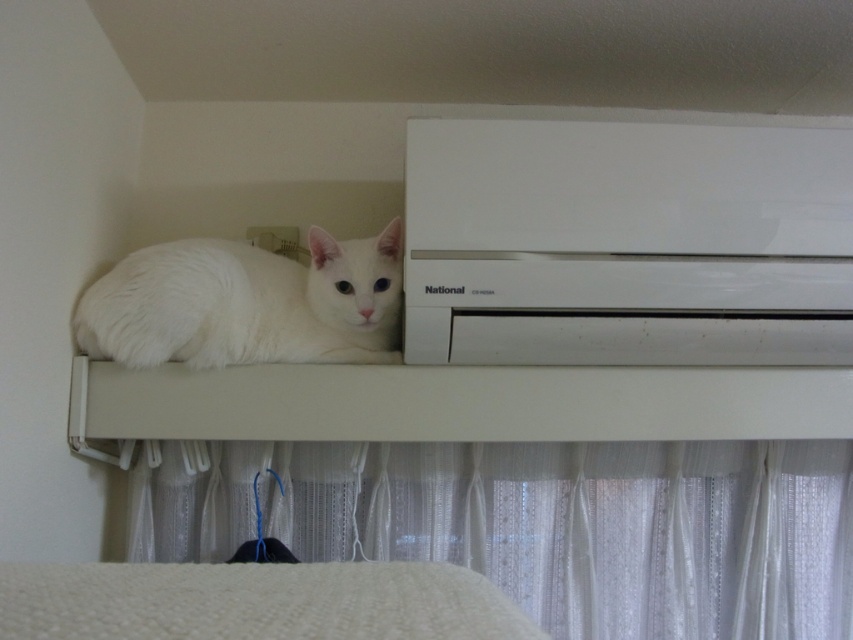
You are a small toy that is 10 cm tall. You are placed on the sheer white curtain at lower center and want to reach the white fluffy cat at upper center. Can you climb up to the cat?

The sheer white curtain at lower center is further to the viewer than white fluffy cat at upper center, meaning the cat is closer to you. Since the curtain is in front of the cat, you can climb up the curtain to reach the white fluffy cat at upper center.

You are a small toy mouse that wants to jump from the white fluffy cat at upper center to the sheer white curtain at lower center. Considering their sizes, will you land safely on the curtain?

The sheer white curtain at lower center is much taller than the white fluffy cat at upper center, so the mouse can safely jump from the white fluffy cat at upper center to the sheer white curtain at lower center because the curtain is taller and provides enough space to land.